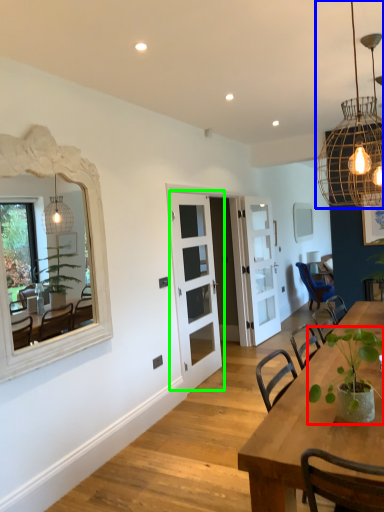
Question: Estimate the real-world distances between objects in this image. Which object is farther from houseplant (highlighted by a red box), light fixture (highlighted by a blue box) or door (highlighted by a green box)?

Choices:
 (A) light fixture
 (B) door

Answer: (B)